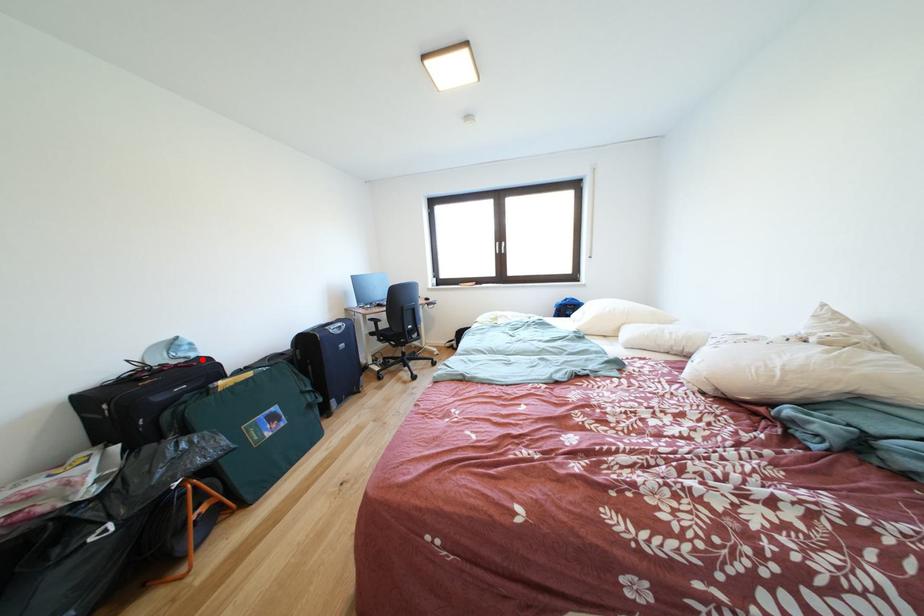
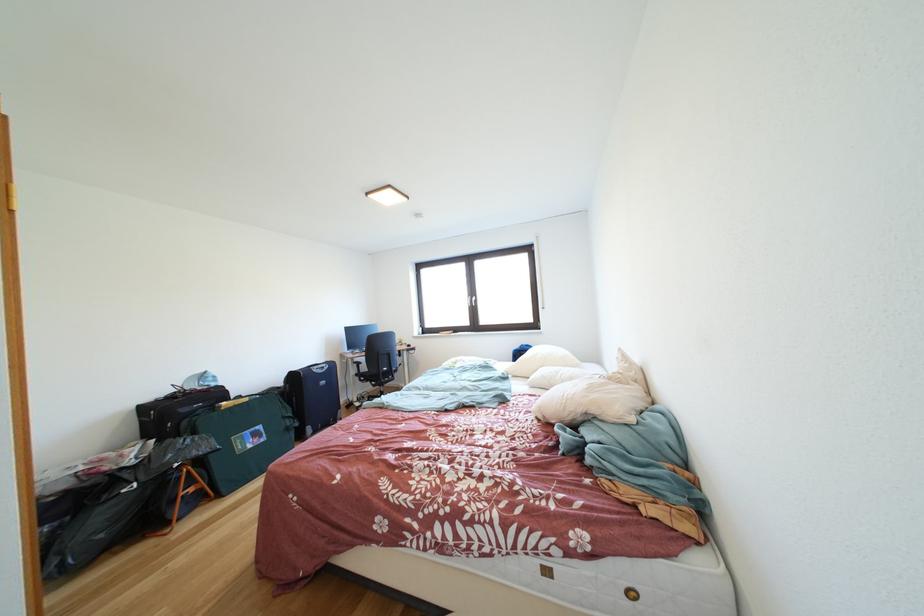
The point at the highlighted location is marked in the first image. Where is the corresponding point in the second image?

(222, 389)